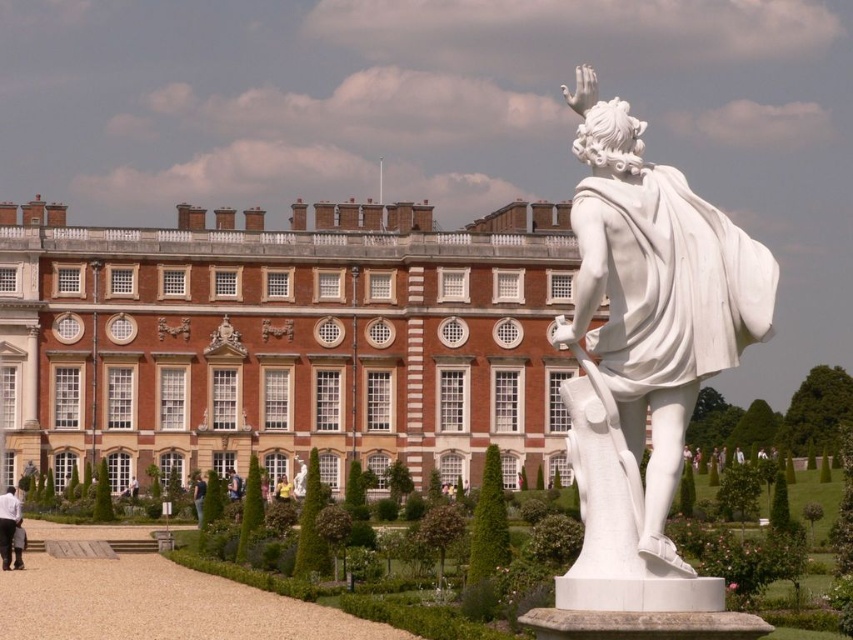
Question: Which point is farther to the camera?

Choices:
 (A) white marble statue at right
 (B) green leafy hedge at center

Answer: (B)

Question: Which object is positioned farthest from the blue jeans at center?

Choices:
 (A) white fabric shirt at lower left
 (B) green leafy hedge at center
 (C) yellow fabric dress at center
 (D) blue denim jeans at lower center

Answer: (B)

Question: Which is farther from the white fabric shirt at lower left?

Choices:
 (A) blue jeans at center
 (B) blue denim jeans at lower center

Answer: (A)

Question: In this image, where is green leafy hedge at center located relative to blue jeans at center?

Choices:
 (A) below
 (B) above

Answer: (B)

Question: In this image, where is green leafy hedge at center located relative to blue jeans at center?

Choices:
 (A) left
 (B) right

Answer: (B)

Question: Is white fabric shirt at lower left closer to the viewer compared to yellow fabric dress at center?

Choices:
 (A) yes
 (B) no

Answer: (A)